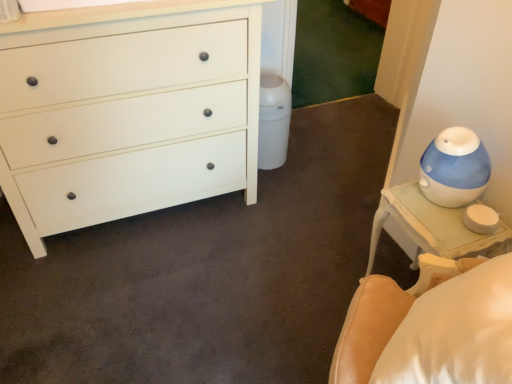
I want to click on vacant area that is in front of white matte chest of drawers at left, so [x=138, y=296].